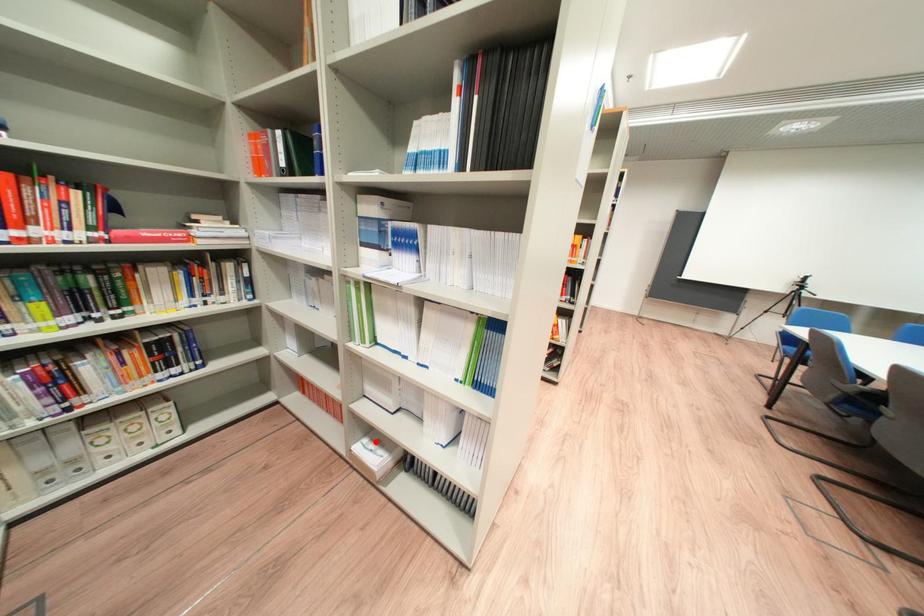
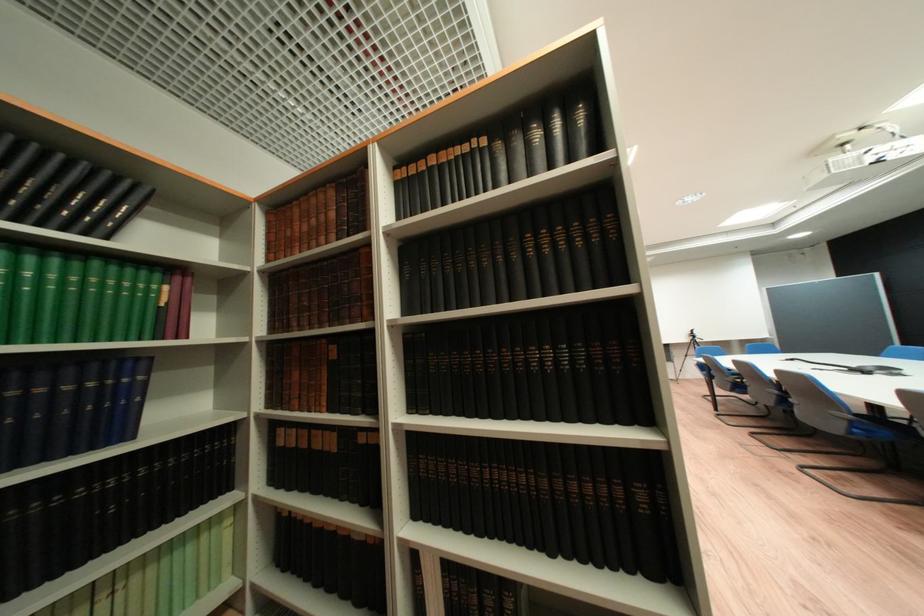
Question: I am providing you with two images of the same scene from different viewpoints. A red point is marked on the first image. At the location where the point appears in image 1, is it still visible in image 2?

Choices:
 (A) Yes
 (B) No

Answer: (B)